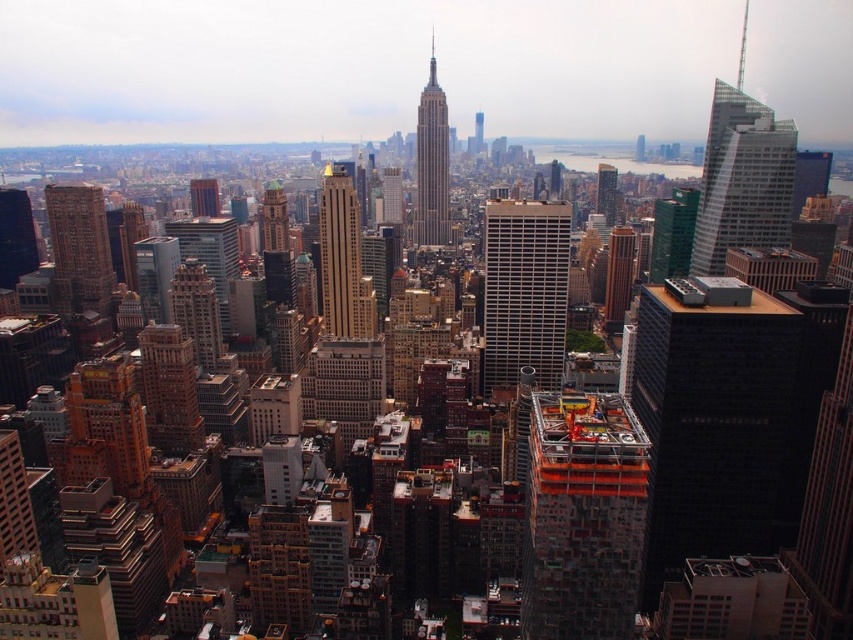
Can you confirm if orange mesh construction at center-right is wider than gold-brick building at center?

Correct, the width of orange mesh construction at center-right exceeds that of gold-brick building at center.

Between orange mesh construction at center-right and gold-brick building at center, which one appears on the left side from the viewer's perspective?

From the viewer's perspective, gold-brick building at center appears more on the left side.

Image resolution: width=853 pixels, height=640 pixels. Find the location of `orange mesh construction at center-right`. orange mesh construction at center-right is located at coordinates pyautogui.click(x=582, y=516).

Does point (752, 209) come behind point (102, 289)?

Yes, point (752, 209) is farther from viewer.

Based on the photo, who is more forward, (744,225) or (53,195)?

Positioned in front is point (744,225).

The image size is (853, 640). I want to click on glassy reflective skyscraper at upper right, so click(741, 179).

Where is `glassy reflective skyscraper at center-right`? glassy reflective skyscraper at center-right is located at coordinates (606, 193).

Can you confirm if glassy reflective skyscraper at center-right is positioned to the right of smooth glass skyscraper at center?

Correct, you'll find glassy reflective skyscraper at center-right to the right of smooth glass skyscraper at center.

The height and width of the screenshot is (640, 853). Find the location of `glassy reflective skyscraper at center-right`. glassy reflective skyscraper at center-right is located at coordinates coord(606,193).